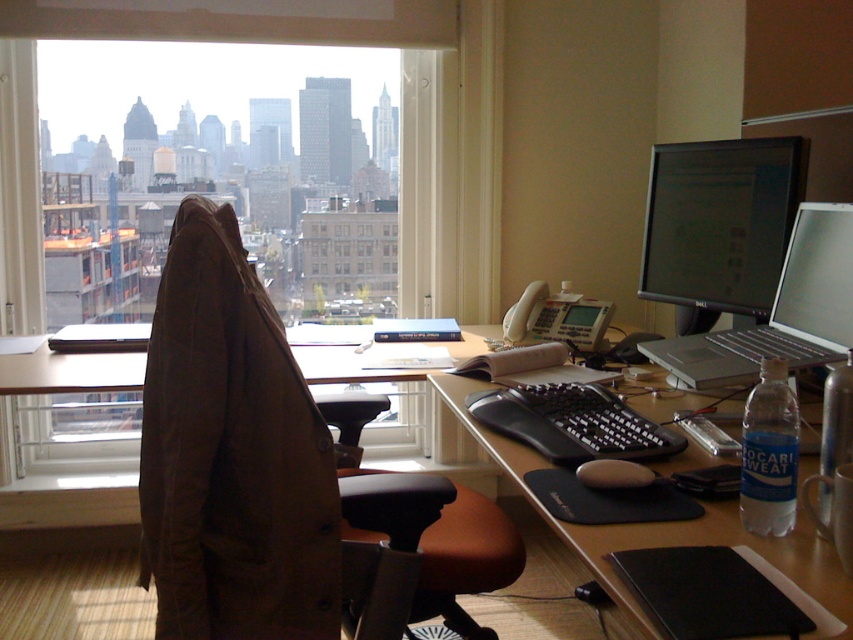
Is point (200, 230) less distant than point (732, 268)?

Yes, it is.

Which is in front, point (271, 468) or point (677, 170)?

Point (271, 468)

Who is more distant from viewer, (184, 598) or (683, 148)?

The point (683, 148) is more distant.

The image size is (853, 640). I want to click on brown fabric swivel chair at center, so click(x=234, y=454).

Between transparent glass window at upper center and black glossy monitor at upper right, which one is positioned lower?

black glossy monitor at upper right is lower down.

Is point (469, 291) closer to viewer compared to point (715, 305)?

No.

Where is `transparent glass window at upper center`? transparent glass window at upper center is located at coordinates (355, 44).

Is black glossy monitor at upper right behind black plastic keyboard at center?

Yes, it is behind black plastic keyboard at center.

Who is taller, black glossy monitor at upper right or black plastic keyboard at center?

With more height is black glossy monitor at upper right.

Locate an element on the screen. This screenshot has height=640, width=853. black glossy monitor at upper right is located at coordinates (720, 224).

Locate an element on the screen. black glossy monitor at upper right is located at coordinates (720, 224).